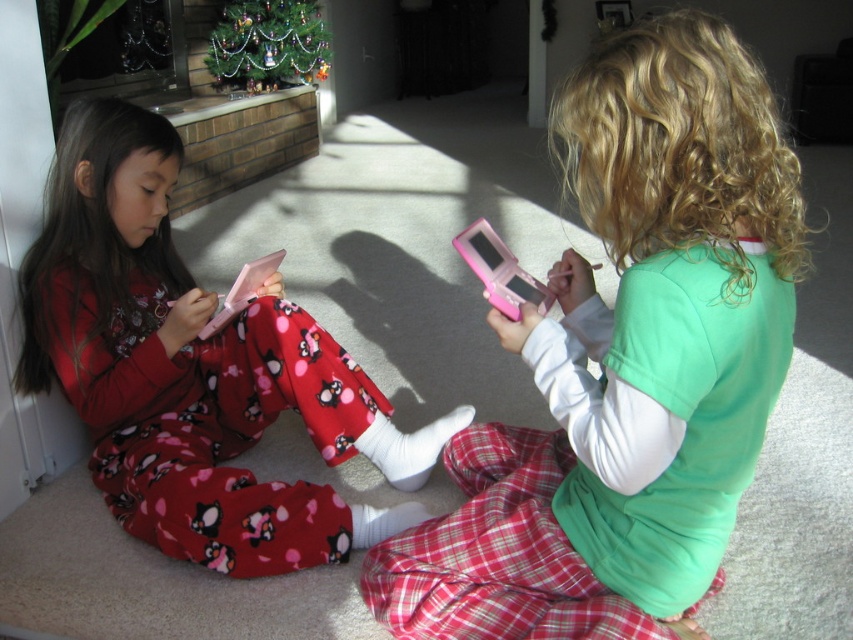
You are a photographer taking a picture of the two children playing with their devices. You notice two points in the scene at coordinates point (733, 321) and point (78, 211). Which point will appear larger in your photo?

Point (733, 321) is closer to the camera than point (78, 211), so it will appear larger in the photo.

You are a parent trying to retrieve your child devices. You see the matte pink toy at center and the matte pink tablet at left. Which one is physically nearer to you?

The matte pink toy at center is closer to the viewer than the matte pink tablet at left, so the matte pink toy at center is nearer to you.

You are standing at the point marked as point (x=241, y=387) in the image. You want to walk to the door located at the far end of the room. How far will you have to walk?

The distance between point (x=241, y=387) and the viewer is 6.15 feet, so you will have to walk 6.15 feet to reach the door located at the far end of the room.